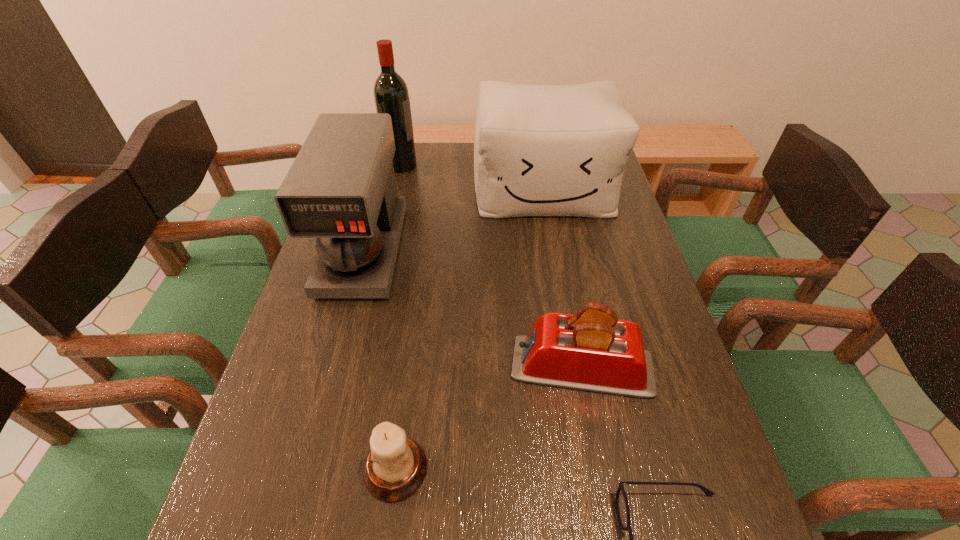
The height and width of the screenshot is (540, 960). What are the coordinates of `vacant space positioned on the left of the third shortest object` in the screenshot? It's located at click(420, 367).

The height and width of the screenshot is (540, 960). I want to click on free space located 0.080m on the back of the fourth object from right to left, so click(405, 401).

In order to click on wine bottle that is at the far edge in this screenshot , I will do `click(391, 95)`.

Locate an element on the screen. The height and width of the screenshot is (540, 960). cushion present at the far edge is located at coordinates (539, 150).

Where is `wine bottle located in the left edge section of the desktop`? wine bottle located in the left edge section of the desktop is located at coordinates (391, 95).

You are a GUI agent. You are given a task and a screenshot of the screen. Output one action in this format:
    pyautogui.click(x=<x>, y=<y>)
    Task: Click on the coffee maker at the left edge
    
    Given the screenshot: What is the action you would take?
    pyautogui.click(x=341, y=189)

At what (x,y) coordinates should I click in order to perform the action: click on cushion present at the right edge. Please return your answer as a coordinate pair (x, y). Looking at the image, I should click on (539, 150).

Locate an element on the screen. Image resolution: width=960 pixels, height=540 pixels. toaster present at the right edge is located at coordinates (592, 350).

This screenshot has height=540, width=960. What are the coordinates of `object at the far left corner` in the screenshot? It's located at (391, 95).

Locate an element on the screen. object at the far right corner is located at coordinates (539, 150).